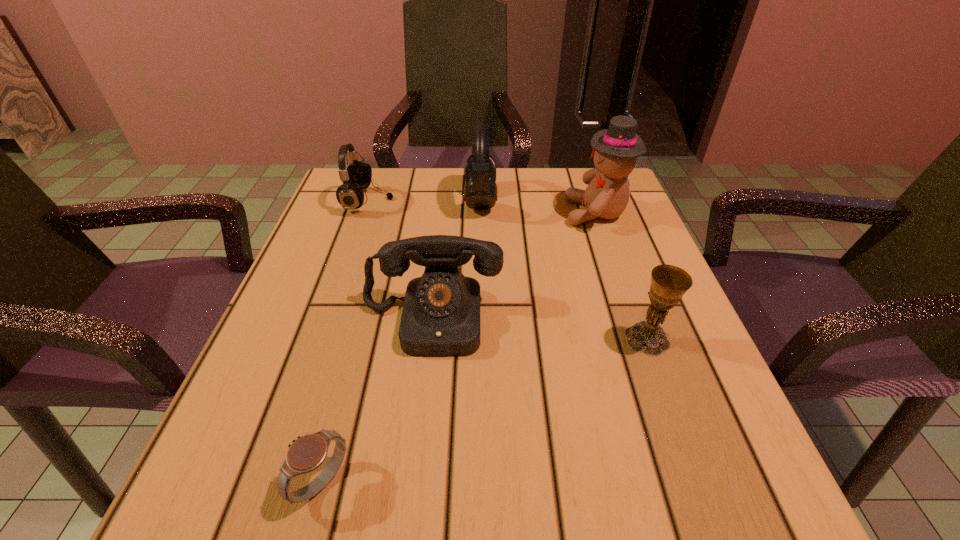
Locate an element on the screen. Image resolution: width=960 pixels, height=540 pixels. vacant space at the left edge is located at coordinates (375, 245).

This screenshot has width=960, height=540. In the image, there is a desktop. In order to click on vacant space at the right edge in this screenshot , I will do `click(635, 413)`.

This screenshot has height=540, width=960. In the image, there is a desktop. Identify the location of free region at the near left corner. (268, 469).

Identify the location of blank space at the far right corner of the desktop. (568, 185).

I want to click on free space between the shorter headset and the watch, so click(x=346, y=342).

The width and height of the screenshot is (960, 540). I want to click on vacant region between the shorter headset and the chalice, so click(508, 271).

Find the location of a particular element. The height and width of the screenshot is (540, 960). free area in between the shorter headset and the chalice is located at coordinates (508, 271).

Identify the location of empty space that is in between the chalice and the telephone. (540, 329).

What are the coordinates of `vacant region between the rag_doll and the fifth shortest object` in the screenshot? It's located at (539, 207).

Identify the location of vacant area between the left headset and the watch. (346, 342).